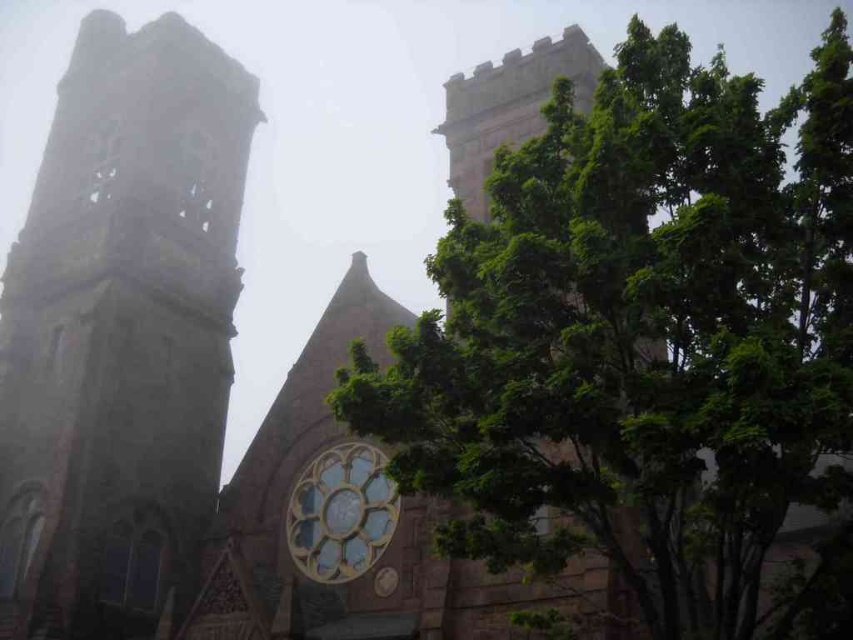
Question: In this image, where is stone tower at left located relative to golden stained glass clock at center?

Choices:
 (A) right
 (B) left

Answer: (B)

Question: Which object is closer to the camera taking this photo?

Choices:
 (A) green leafy tree at upper center
 (B) golden stained glass clock at center

Answer: (A)

Question: Considering the real-world distances, which object is closest to the golden stained glass clock at center?

Choices:
 (A) green leafy tree at upper center
 (B) stone tower at left

Answer: (A)

Question: Which is farther from the stone tower at left?

Choices:
 (A) golden stained glass clock at center
 (B) green leafy tree at upper center

Answer: (B)

Question: Is green leafy tree at upper center thinner than stone tower at left?

Choices:
 (A) no
 (B) yes

Answer: (A)

Question: In this image, where is stone tower at left located relative to golden stained glass clock at center?

Choices:
 (A) left
 (B) right

Answer: (A)